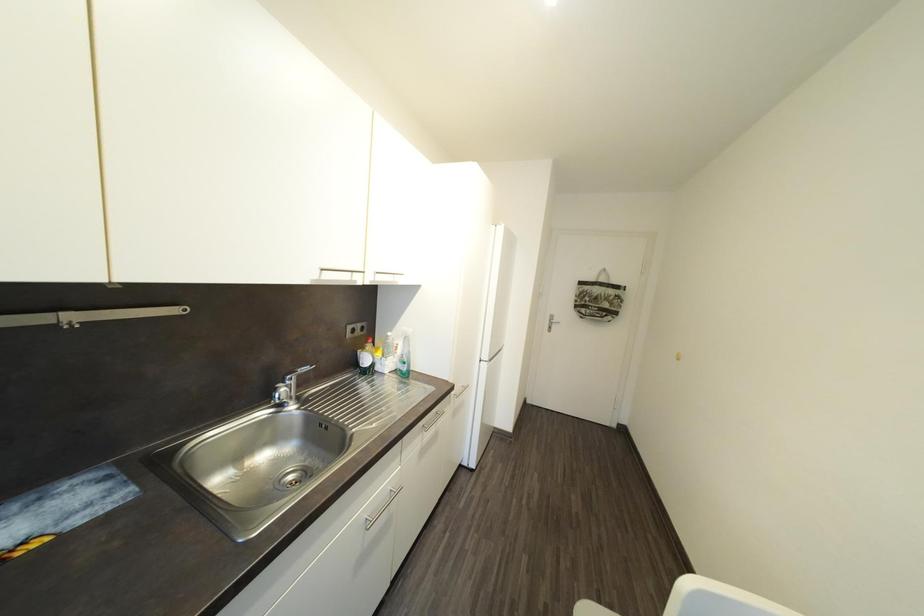
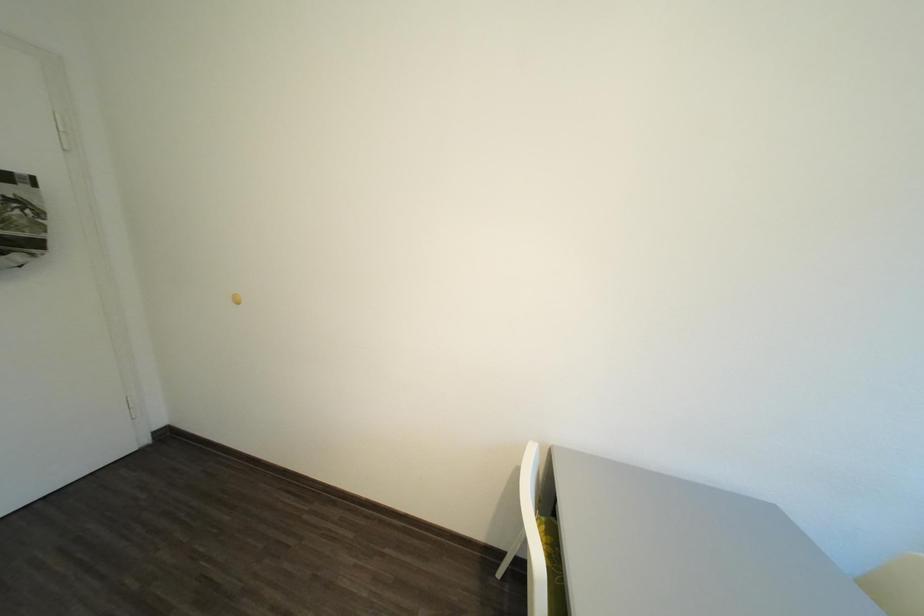
Based on the continuous images, in which direction is the camera rotating?

The camera rotated toward right-down.